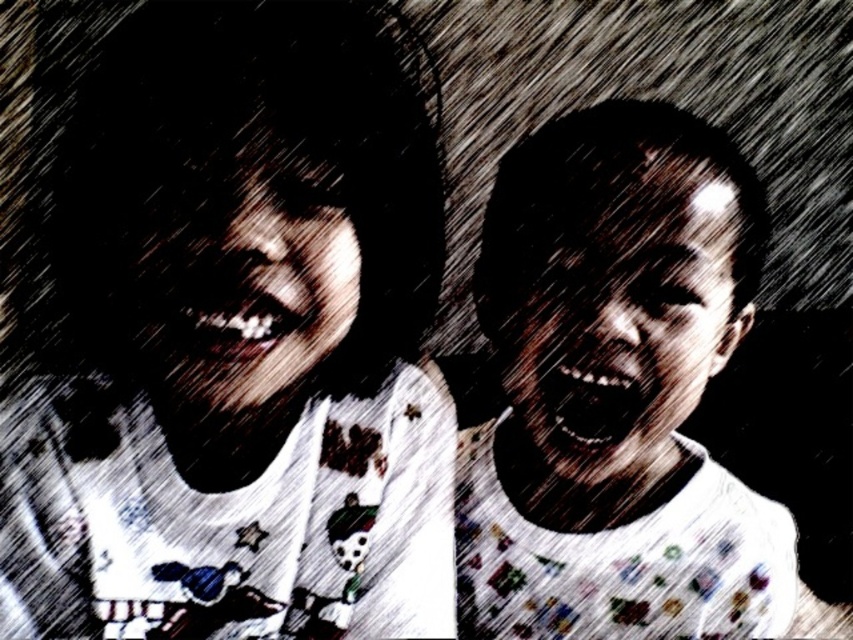
Image resolution: width=853 pixels, height=640 pixels. What do you see at coordinates (234, 346) in the screenshot? I see `white printed shirt at upper left` at bounding box center [234, 346].

Image resolution: width=853 pixels, height=640 pixels. What are the coordinates of `white printed shirt at upper left` in the screenshot? It's located at (234, 346).